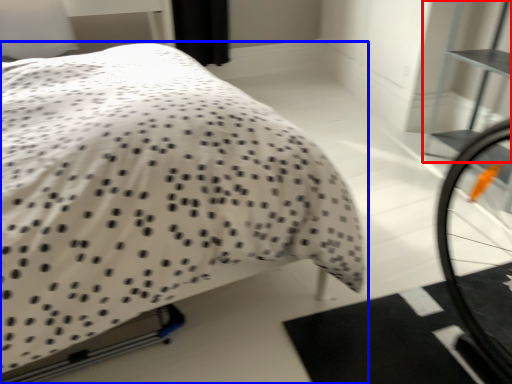
Question: Which point is closer to the camera, bookshelf (highlighted by a red box) or bed (highlighted by a blue box)?

Choices:
 (A) bookshelf
 (B) bed

Answer: (B)